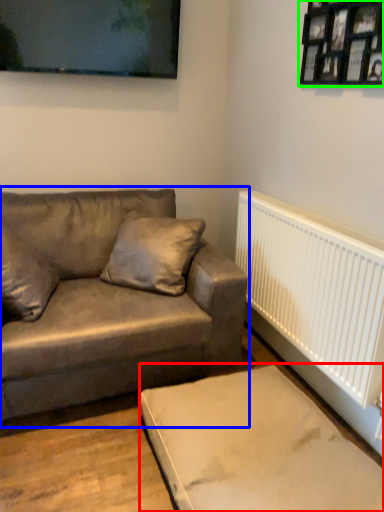
Question: Which object is the farthest from furniture (highlighted by a red box)? Choose among these: studio couch (highlighted by a blue box) or picture frame (highlighted by a green box).

Choices:
 (A) studio couch
 (B) picture frame

Answer: (B)